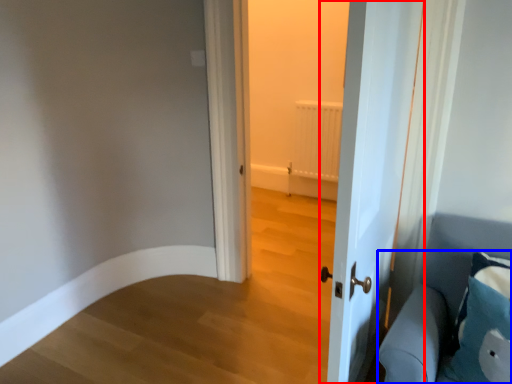
Question: Which point is further to the camera, door (highlighted by a red box) or furniture (highlighted by a blue box)?

Choices:
 (A) door
 (B) furniture

Answer: (B)